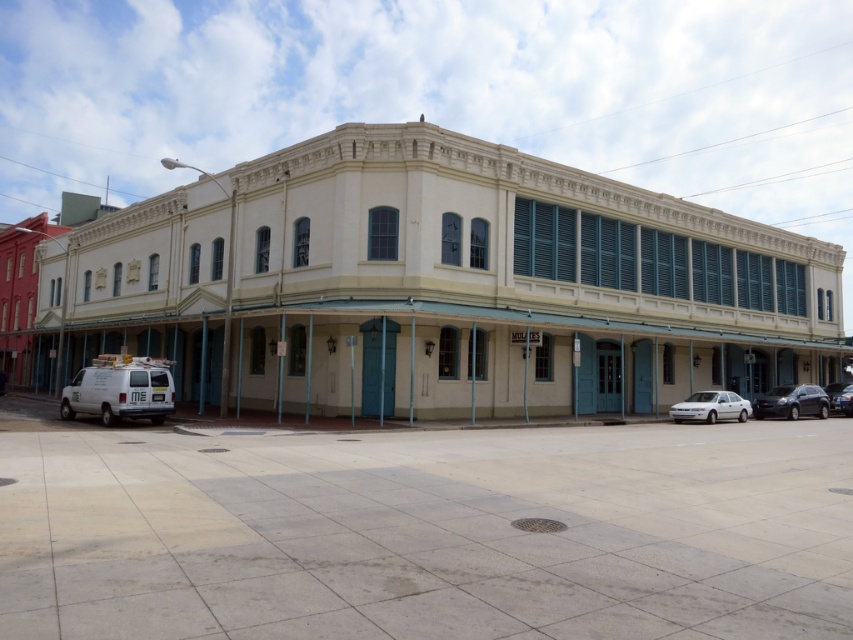
You are standing at the entrance of the two story building and see two points marked on the building facade. The first point is at coordinate point [482,225] and the second is at point [831,387]. Which point is closer to you?

Point [482,225] is in front of point [831,387], so the first point is closer to you.

You are standing in front of the two story building and want to determine the relative positions of two points marked on the facade. Which point is closer to you, the point at coordinates point (476, 236) or point (706, 419)?

Point (476, 236) is closer to the viewer than point (706, 419).

You are driving a delivery van that is 2.5 meters wide. You need to park your van between the matte white building at center and the white glossy sedan at lower center. Can your van fit in that space?

The matte white building at center might be wider than the white glossy sedan at lower center, but without exact measurements, it is uncertain if the space between them is sufficient for a 2.5 meter wide van. Check the actual width before attempting to park.